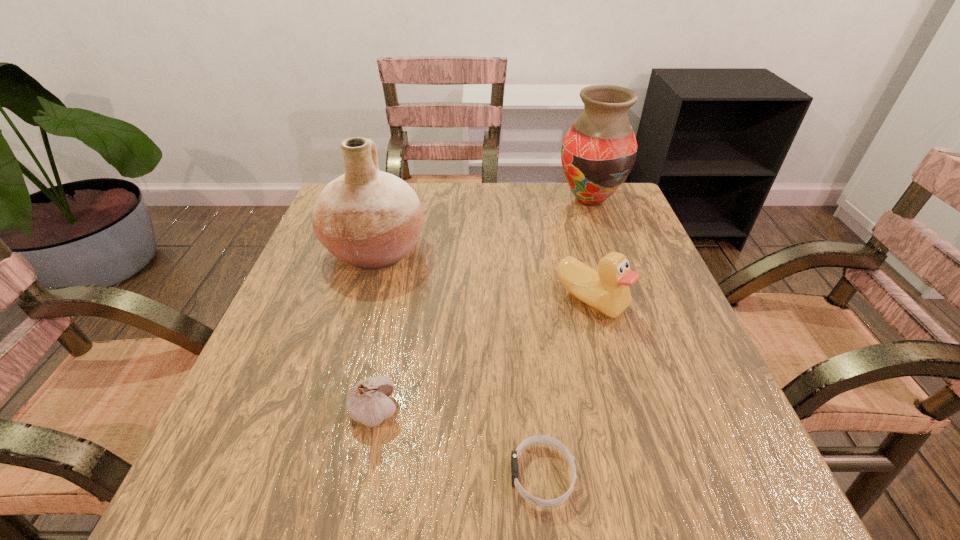
At what (x,y) coordinates should I click in order to perform the action: click on free location that satisfies the following two spatial constraints: 1. on the back side of the garlic; 2. to pour from the handle of the pottery. Please return your answer as a coordinate pair (x, y). Looking at the image, I should click on (407, 250).

The width and height of the screenshot is (960, 540). I want to click on vacant space that satisfies the following two spatial constraints: 1. at the beak of the third shortest object; 2. on the outer surface of the third object from left to right, so [x=639, y=475].